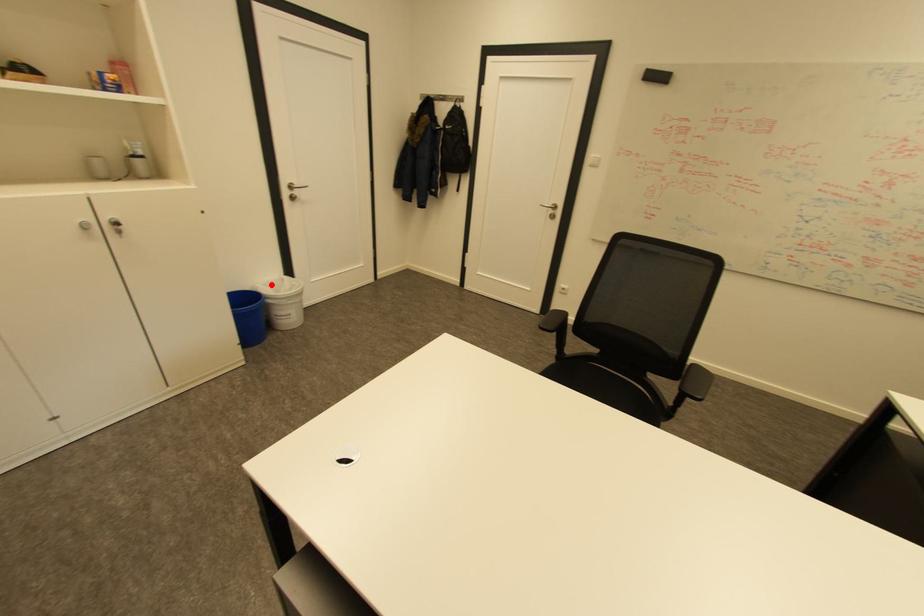
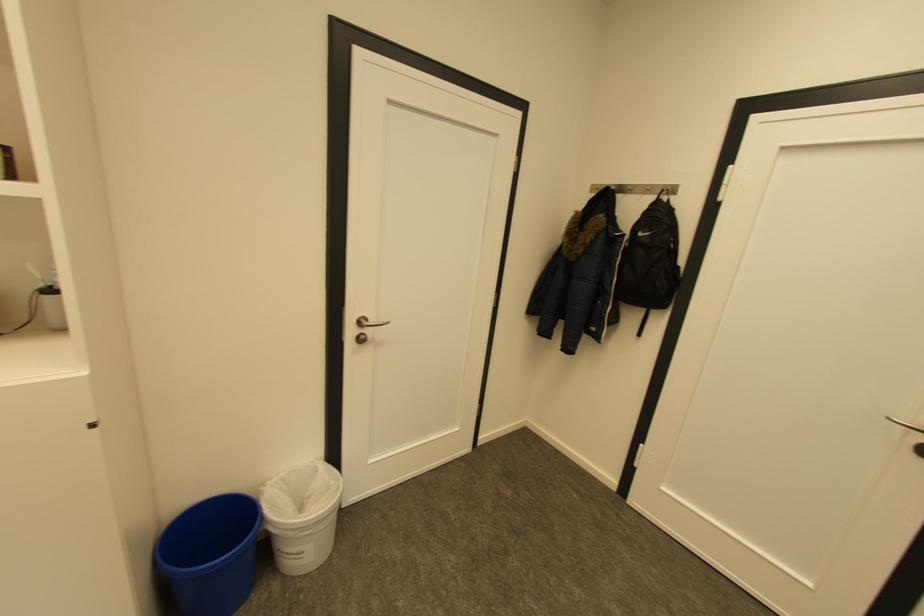
Question: I am providing you with two images of the same scene from different viewpoints. Image1 has a red point marked. In image2, the corresponding 3D location appears at what relative position? Reply with the corresponding letter.

Choices:
 (A) Closer
 (B) Farther

Answer: (B)